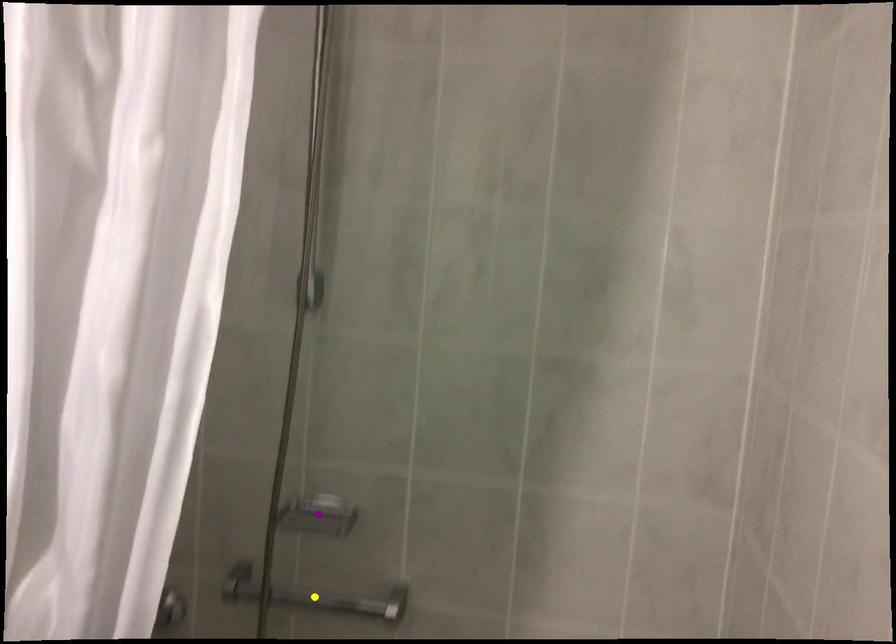
Order these from nearest to farthest:
purple point
green point
yellow point

purple point
green point
yellow point